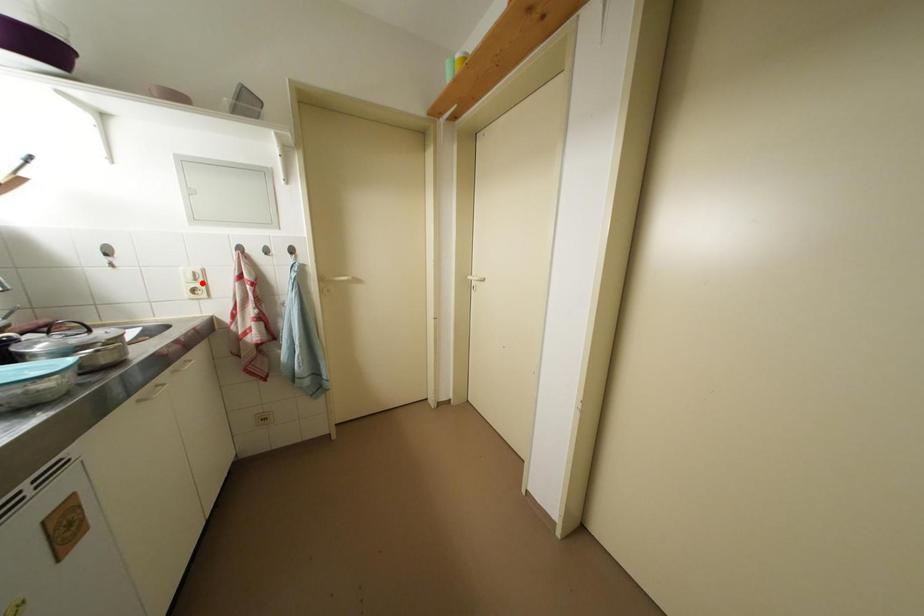
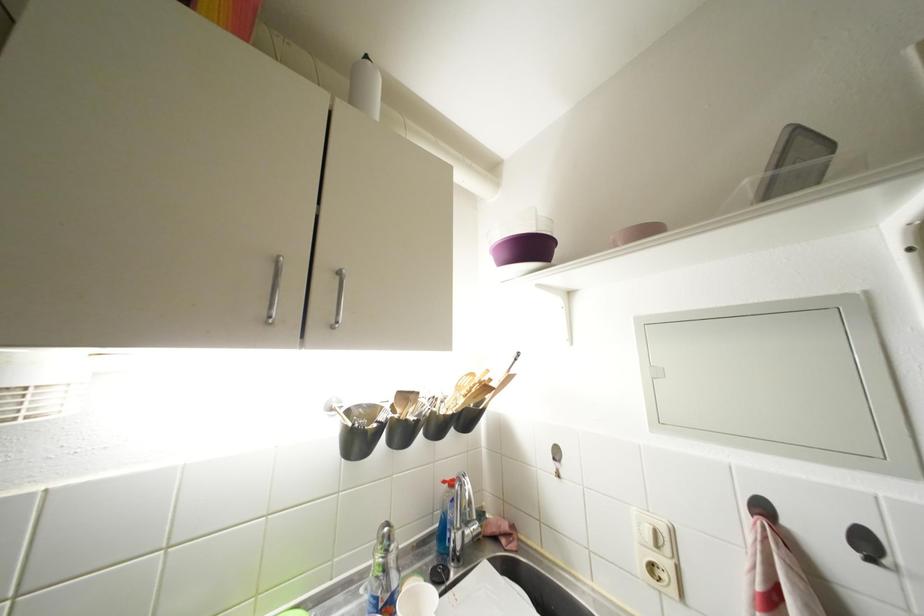
In the second image, find the point that corresponds to the highlighted location in the first image.

(663, 549)